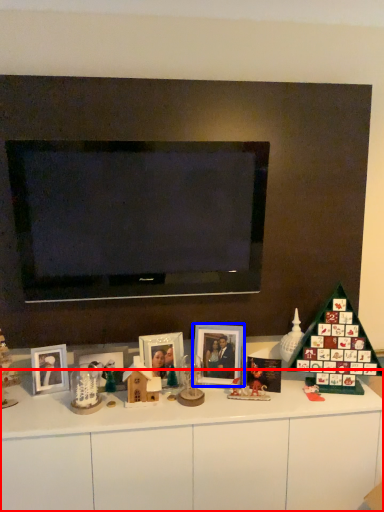
Question: Which point is closer to the camera, dresser (highlighted by a red box) or picture frame (highlighted by a blue box)?

Choices:
 (A) dresser
 (B) picture frame

Answer: (A)